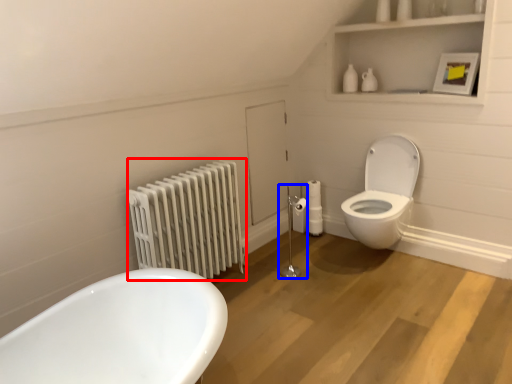
Question: Which of the following is the closest to the observer, radiator (highlighted by a red box) or shower (highlighted by a blue box)?

Choices:
 (A) radiator
 (B) shower

Answer: (A)